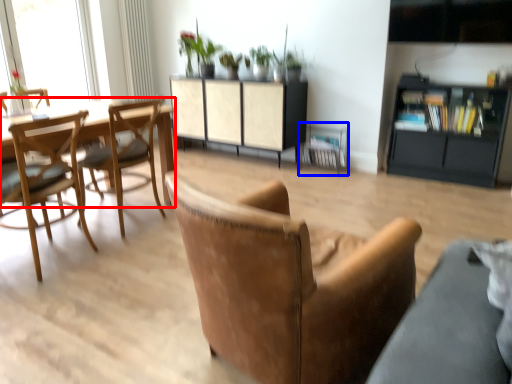
Question: Which of the following is the farthest to the observer, round table (highlighted by a red box) or armchair (highlighted by a blue box)?

Choices:
 (A) round table
 (B) armchair

Answer: (B)